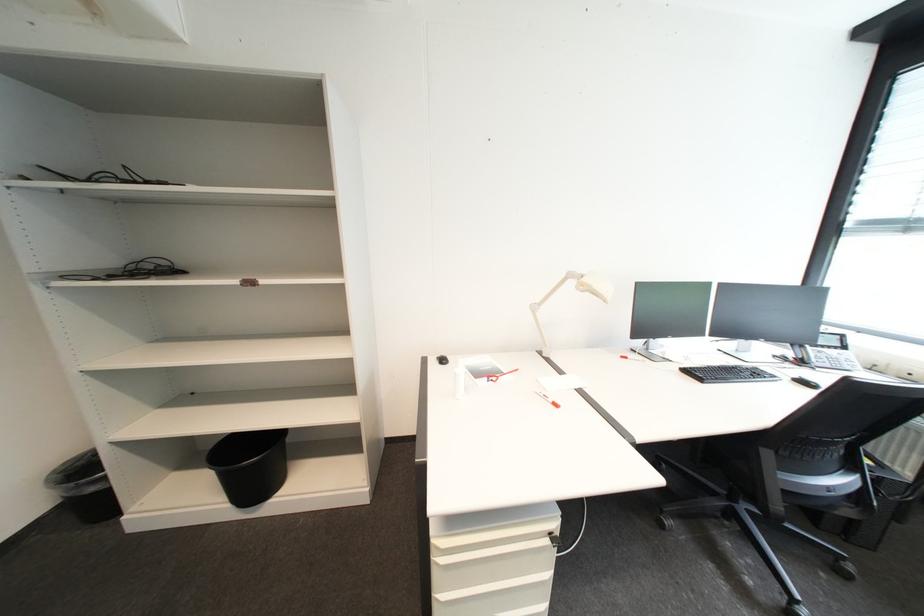
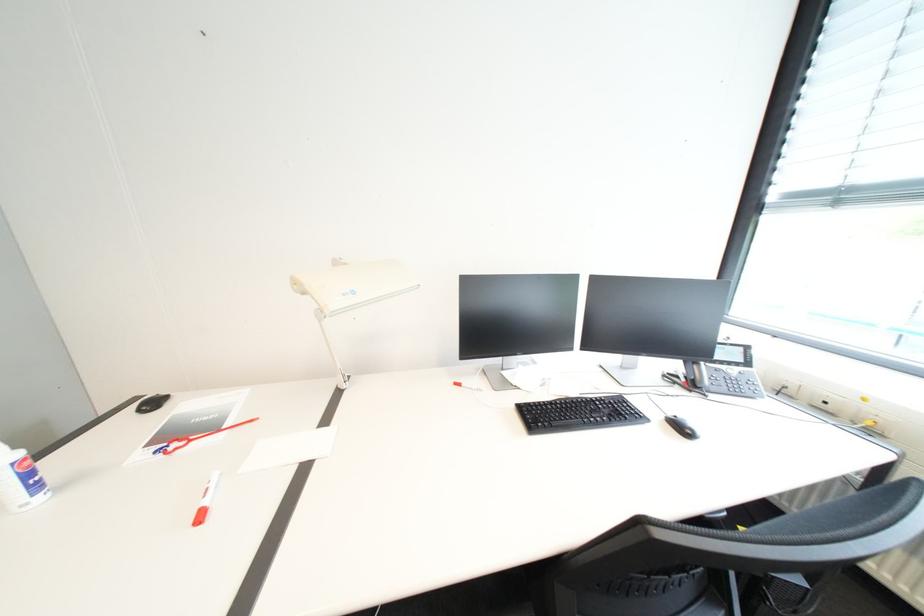
In the scene shown: Which direction would the cameraman need to move to produce the second image?

The cameraman walked toward right, forward.